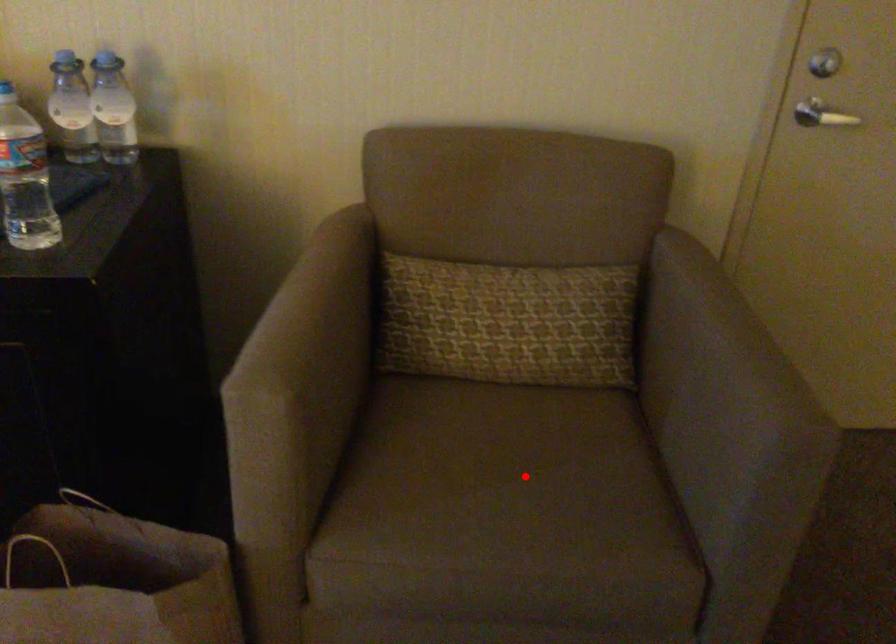
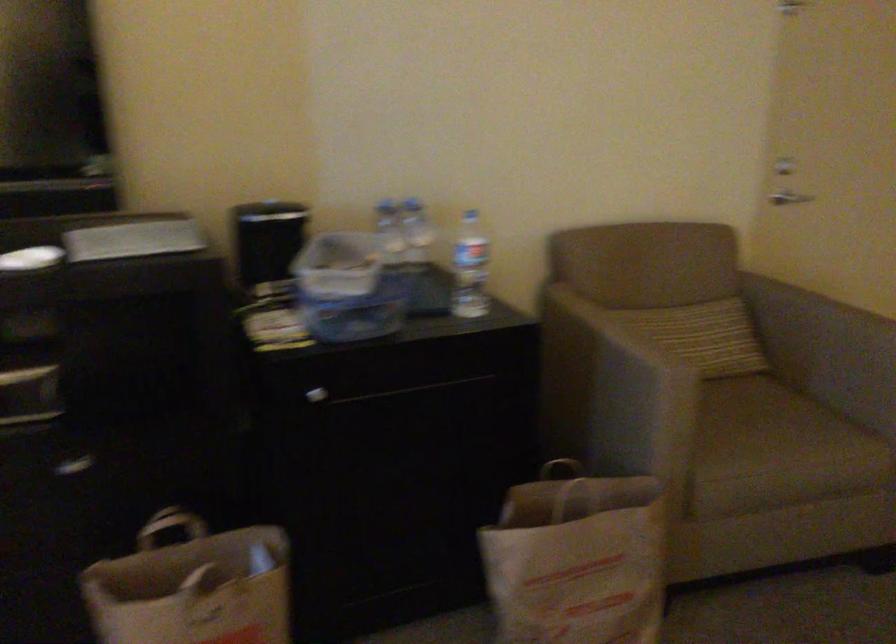
Question: A red point is marked in image1. In image2, is the corresponding 3D point closer to the camera or farther? Reply with the corresponding letter.

Choices:
 (A) The corresponding 3D point is closer.
 (B) The corresponding 3D point is farther.

Answer: (B)